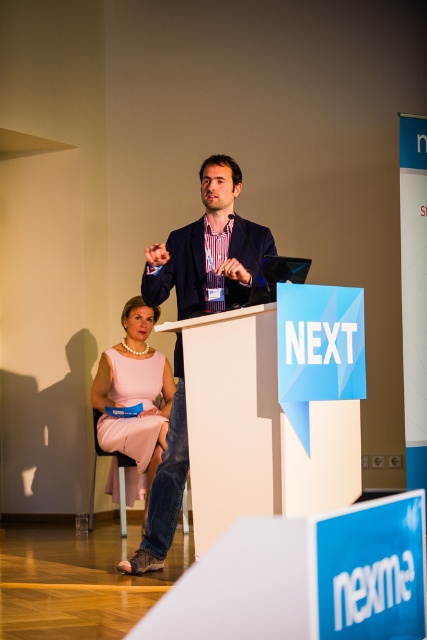
In the presentation scene, there are two attendees dressed in a dark blue suit at center and a pink satin dress at lower left. Which attendee is wearing a larger outfit?

The dark blue suit at center has a larger size compared to the pink satin dress at lower left, so the attendee in the dark blue suit at center is wearing the larger outfit.

From the picture: In the presentation scene, there are two attendees dressed in a dark blue suit at center and a pink satin dress at lower left. From the speaker at the podium, which direction should they look to see the speaker?

Both the dark blue suit at center and the pink satin dress at lower left should look towards the podium since the speaker is standing behind it.

Where is the dark blue suit at center located in the image?

The dark blue suit at center is located at point coordinates of (208, 250).